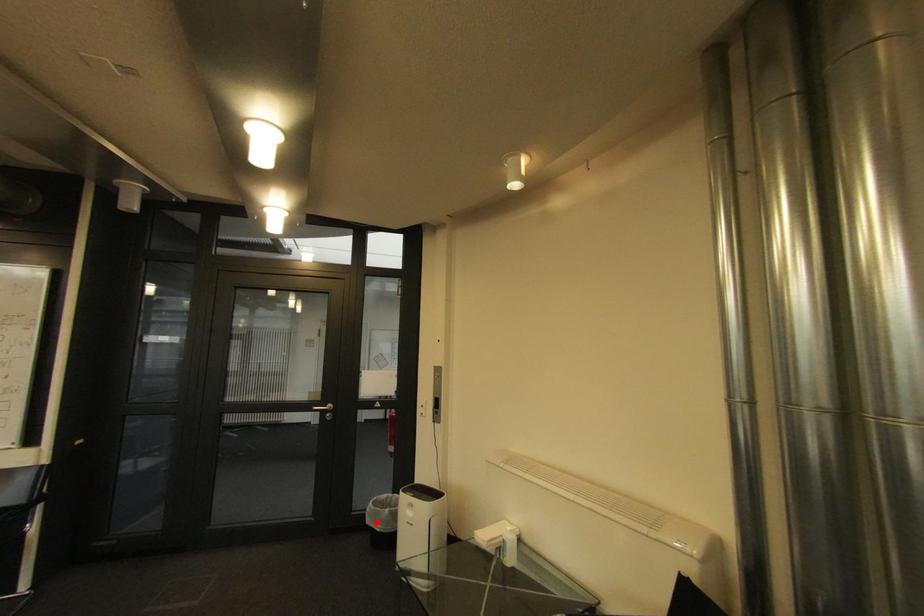
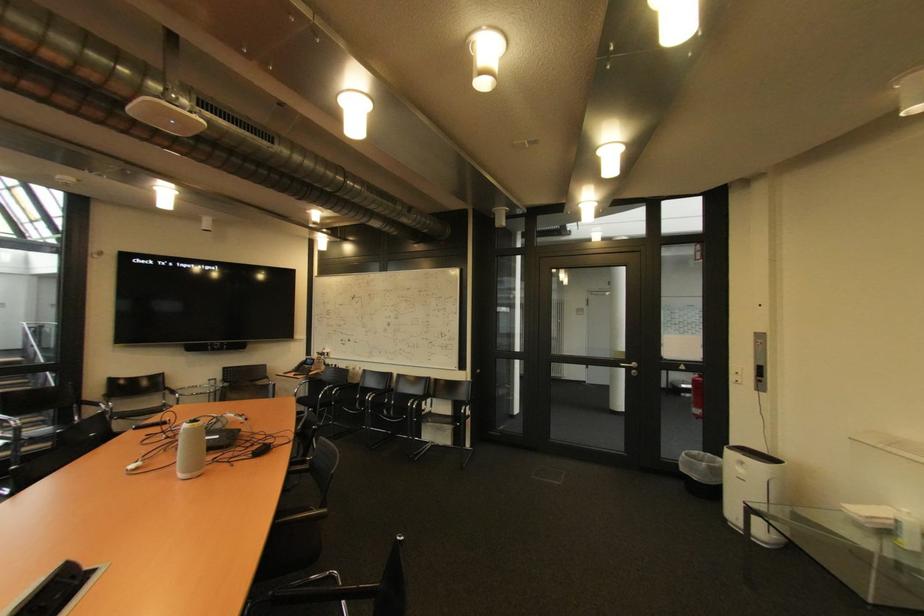
Question: I am providing you with two images of the same scene from different viewpoints. Image1 has a red point marked. In image2, the corresponding 3D location appears at what relative position? Reply with the corresponding letter.

Choices:
 (A) Closer
 (B) Farther

Answer: (A)